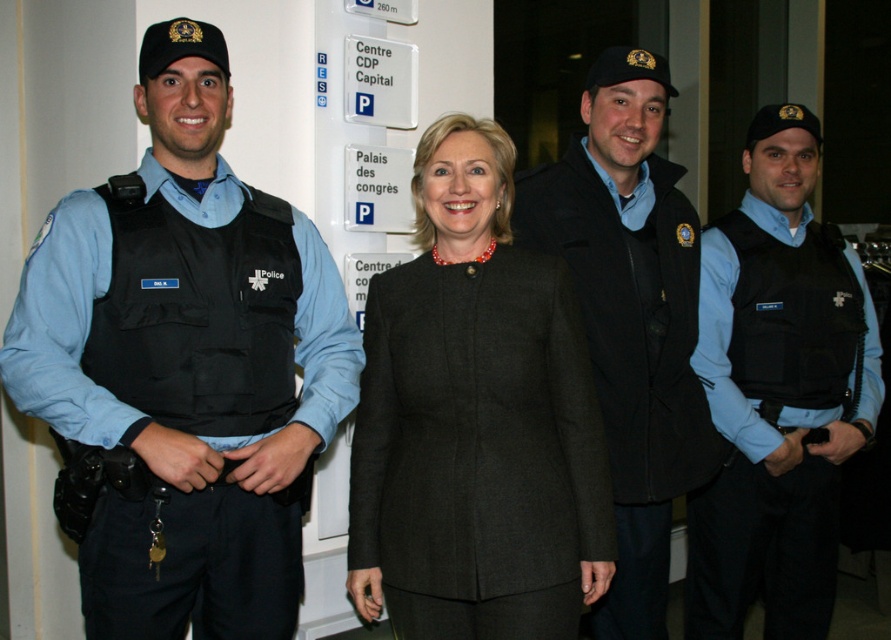
Question: Can you confirm if black matte vest at left is positioned above dark gray wool coat at center?

Choices:
 (A) yes
 (B) no

Answer: (A)

Question: Which point appears closest to the camera in this image?

Choices:
 (A) (485, 342)
 (B) (119, 522)

Answer: (B)

Question: Can you confirm if black matte vest at left is positioned below dark gray wool coat at center?

Choices:
 (A) yes
 (B) no

Answer: (B)

Question: Which of the following is the closest to the observer?

Choices:
 (A) black matte vest at left
 (B) black matte vest at center
 (C) dark gray wool coat at center
 (D) black matte jacket at center

Answer: (A)

Question: Which point is closer to the camera?

Choices:
 (A) dark gray wool coat at center
 (B) black matte vest at left
 (C) black matte jacket at center

Answer: (B)

Question: Can you confirm if black matte vest at center is bigger than black matte jacket at center?

Choices:
 (A) no
 (B) yes

Answer: (B)